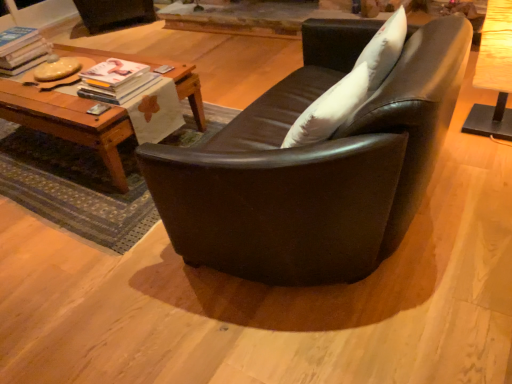
Question: Is woodenwoodentable at left, placed as the 2th table when sorted from right to left, not within matte white magazine at center left, which ranks as the first magazine in front-to-back order?

Choices:
 (A) no
 (B) yes

Answer: (B)

Question: From a real-world perspective, is woodenwoodentable at left, placed as the 2th table when sorted from right to left, physically below matte white magazine at center left, positioned as the second magazine in top-to-bottom order?

Choices:
 (A) no
 (B) yes

Answer: (B)

Question: Are woodenwoodentable at left, which is the 1th table in left-to-right order, and matte white magazine at center left, which ranks as the first magazine in front-to-back order, making contact?

Choices:
 (A) no
 (B) yes

Answer: (A)

Question: Does woodenwoodentable at left, which is the 1th table in left-to-right order, have a lesser width compared to matte white magazine at center left, the 1th magazine positioned from the bottom?

Choices:
 (A) yes
 (B) no

Answer: (B)

Question: Is matte white magazine at center left, the second magazine from the back, at the back of woodenwoodentable at left, placed as the 2th table when sorted from right to left?

Choices:
 (A) no
 (B) yes

Answer: (A)

Question: Does point (192, 76) appear closer or farther from the camera than point (401, 26)?

Choices:
 (A) closer
 (B) farther

Answer: (B)

Question: Is woodenwoodentable at left, which is the 1th table in left-to-right order, wider or thinner than white soft pillow at upper right?

Choices:
 (A) thin
 (B) wide

Answer: (B)

Question: Choose the correct answer: Is woodenwoodentable at left, placed as the 2th table when sorted from right to left, inside white soft pillow at upper right or outside it?

Choices:
 (A) inside
 (B) outside

Answer: (B)

Question: From the image's perspective, relative to white soft pillow at upper right, is woodenwoodentable at left, which is the 1th table in left-to-right order, above or below?

Choices:
 (A) above
 (B) below

Answer: (B)

Question: From a real-world perspective, is white soft pillow at upper right positioned above or below wooden table at right, acting as the 1th table starting from the right?

Choices:
 (A) below
 (B) above

Answer: (B)

Question: Is point (402, 43) closer or farther from the camera than point (480, 62)?

Choices:
 (A) farther
 (B) closer

Answer: (B)

Question: Is white soft pillow at upper right to the left or to the right of wooden table at right, the 2th table viewed from the left, in the image?

Choices:
 (A) left
 (B) right

Answer: (A)

Question: Considering their positions, is white soft pillow at upper right located in front of or behind wooden table at right, the 2th table viewed from the left?

Choices:
 (A) front
 (B) behind

Answer: (A)

Question: Considering the relative positions of matte white magazine at upper left, positioned as the second magazine in bottom-to-top order, and matte white magazine at center left, arranged as the second magazine when viewed from the left, in the image provided, is matte white magazine at upper left, positioned as the second magazine in bottom-to-top order, to the left or to the right of matte white magazine at center left, arranged as the second magazine when viewed from the left,?

Choices:
 (A) right
 (B) left

Answer: (B)

Question: In the image, is matte white magazine at upper left, arranged as the first magazine when viewed from the left, positioned in front of or behind matte white magazine at center left, the 1th magazine positioned from the bottom?

Choices:
 (A) front
 (B) behind

Answer: (B)